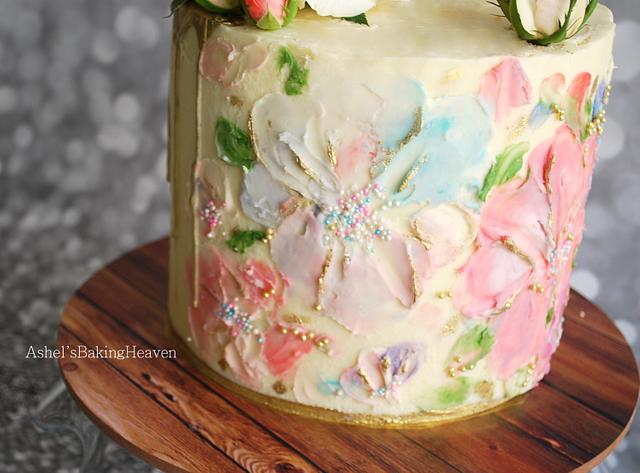
Image resolution: width=640 pixels, height=473 pixels. In order to click on countertop in background left of cake in this screenshot , I will do `click(63, 70)`.